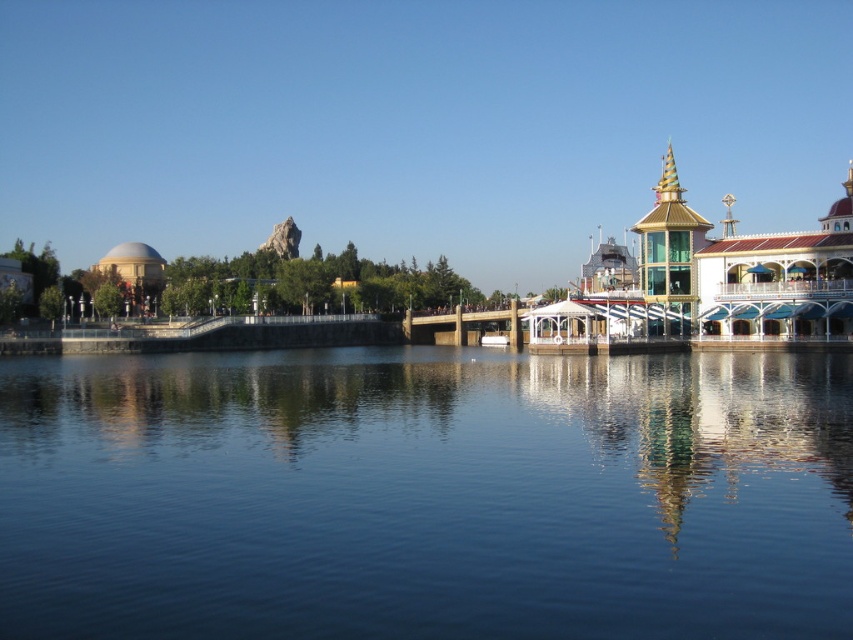
Who is lower down, white glossy building at right or brown wooden dock at center?

brown wooden dock at center

Is point (712, 328) positioned after point (505, 339)?

That is False.

Where is `white glossy building at right`? white glossy building at right is located at coordinates (735, 275).

Does transparent water at center appear on the left side of white glossy building at right?

Correct, you'll find transparent water at center to the left of white glossy building at right.

Is point (712, 380) farther from camera compared to point (759, 253)?

That is False.

Locate an element on the screen. The width and height of the screenshot is (853, 640). transparent water at center is located at coordinates (425, 493).

Who is positioned more to the left, matte white building at left or white plastic boat at center?

From the viewer's perspective, matte white building at left appears more on the left side.

Is matte white building at left to the right of white plastic boat at center from the viewer's perspective?

Incorrect, matte white building at left is not on the right side of white plastic boat at center.

Who is more forward, (160,288) or (502,336)?

Point (502,336) is more forward.

Where is `matte white building at left`? The height and width of the screenshot is (640, 853). matte white building at left is located at coordinates (247, 282).